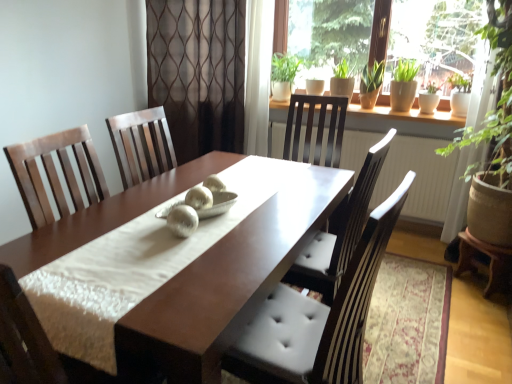
The width and height of the screenshot is (512, 384). What do you see at coordinates (318, 318) in the screenshot? I see `matte brown chair at center` at bounding box center [318, 318].

Where is `white glossy radiator at upper center`? white glossy radiator at upper center is located at coordinates (418, 177).

The height and width of the screenshot is (384, 512). What do you see at coordinates (498, 99) in the screenshot?
I see `green leafy plant at right` at bounding box center [498, 99].

What are the coordinates of `matte white table at lower right, the 2th table from the left` in the screenshot? It's located at (x=489, y=263).

What is the approximate width of brown sheer curtain at center?

brown sheer curtain at center is 23.97 centimeters wide.

Where is `matte brown chair at center`? The width and height of the screenshot is (512, 384). matte brown chair at center is located at coordinates (318, 318).

From a real-world perspective, is white glossy radiator at upper center under brown sheer curtain at center?

Yes.

Is white glossy radiator at upper center further to the viewer compared to brown sheer curtain at center?

No, white glossy radiator at upper center is closer to the viewer.

Is white glossy radiator at upper center shorter than brown sheer curtain at center?

Indeed, white glossy radiator at upper center has a lesser height compared to brown sheer curtain at center.

Which is behind, point (416, 148) or point (200, 69)?

The point (200, 69) is more distant.

Measure the distance from matte white table at lower right, which is the 1th table in right-to-left order, to shiny brown table at center, acting as the second table starting from the right.

The distance of matte white table at lower right, which is the 1th table in right-to-left order, from shiny brown table at center, acting as the second table starting from the right, is 4.75 feet.

From a real-world perspective, which is physically above, matte white table at lower right, the 2th table from the left, or shiny brown table at center, acting as the second table starting from the right?

In real-world perspective, shiny brown table at center, acting as the second table starting from the right, is above.

Can you tell me how much matte white table at lower right, which is the 1th table in right-to-left order, and shiny brown table at center, positioned as the 1th table in left-to-right order, differ in facing direction?

39.7 degrees separate the facing orientations of matte white table at lower right, which is the 1th table in right-to-left order, and shiny brown table at center, positioned as the 1th table in left-to-right order.

Image resolution: width=512 pixels, height=384 pixels. I want to click on table in front of the matte white table at lower right, which is the 1th table in right-to-left order, so click(230, 280).

Is green leafy plant at right not near matte brown chair at center?

green leafy plant at right is positioned a significant distance from matte brown chair at center.

Consider the image. From a real-world perspective, is green leafy plant at right positioned above or below matte brown chair at center?

From a real-world perspective, green leafy plant at right is physically above matte brown chair at center.

Looking at this image, can you tell me how much green leafy plant at right and matte brown chair at center differ in facing direction?

They differ by 63 degrees in their facing directions.

Which of these two, green leafy plant at right or matte brown chair at center, is smaller?

With smaller size is green leafy plant at right.

Is brown sheer curtain at center a part of matte brown chair at center?

Actually, brown sheer curtain at center is outside matte brown chair at center.

Where is `screen door above the matte brown chair at center (from the image's perspective)`? The width and height of the screenshot is (512, 384). screen door above the matte brown chair at center (from the image's perspective) is located at coordinates (198, 72).

Which object is positioned more to the right, matte brown chair at center or brown sheer curtain at center?

From the viewer's perspective, matte brown chair at center appears more on the right side.

Is matte brown chair at center not close to brown sheer curtain at center?

Indeed, matte brown chair at center is not near brown sheer curtain at center.

From the image's perspective, which one is positioned higher, green leafy plant at right or brown sheer curtain at center?

brown sheer curtain at center appears higher in the image.

Is green leafy plant at right next to brown sheer curtain at center?

No, green leafy plant at right is not touching brown sheer curtain at center.

Considering the sizes of objects green leafy plant at right and brown sheer curtain at center in the image provided, who is taller, green leafy plant at right or brown sheer curtain at center?

With more height is green leafy plant at right.

How distant is green leafy plant at right from brown sheer curtain at center?

A distance of 1.85 meters exists between green leafy plant at right and brown sheer curtain at center.

Where is `the 1st table in front of the green leafy plant at right, counting from the anchor's position`? This screenshot has width=512, height=384. the 1st table in front of the green leafy plant at right, counting from the anchor's position is located at coordinates (489, 263).

Is matte white table at lower right, which is the 1th table in right-to-left order, located outside green leafy plant at right?

Yes, matte white table at lower right, which is the 1th table in right-to-left order, is located beyond the bounds of green leafy plant at right.

How distant is matte white table at lower right, which is the 1th table in right-to-left order, from green leafy plant at right?

matte white table at lower right, which is the 1th table in right-to-left order, and green leafy plant at right are 25.08 inches apart from each other.

Is matte white table at lower right, the 2th table from the left, directly adjacent to green leafy plant at right?

No.

From the image's perspective, between brown sheer curtain at center and green leafy plant at right, which one is located above?

From the image's view, brown sheer curtain at center is above.

Does brown sheer curtain at center have a greater width compared to green leafy plant at right?

Correct, the width of brown sheer curtain at center exceeds that of green leafy plant at right.

Is point (241, 90) more distant than point (453, 260)?

Yes, it is.

Who is taller, brown sheer curtain at center or green leafy plant at right?

With more height is green leafy plant at right.

Locate an element on the screen. radiator below the brown sheer curtain at center (from a real-world perspective) is located at coordinates (418, 177).

You are a GUI agent. You are given a task and a screenshot of the screen. Output one action in this format:
    pyautogui.click(x=<x>, y=<y>)
    Task: Click on the table above the matte white table at lower right, which is the 1th table in right-to-left order (from the image's perspective)
    
    Given the screenshot: What is the action you would take?
    point(230,280)

Consider the image. Looking at the image, which one is located further to matte brown chair at center, matte white table at lower right, which is the 1th table in right-to-left order, or green leafy plant at right?

The object further to matte brown chair at center is green leafy plant at right.

Considering their positions, is brown sheer curtain at center positioned further to shiny brown table at center, acting as the second table starting from the right, than green leafy plant at right?

Result: brown sheer curtain at center is further to shiny brown table at center, acting as the second table starting from the right.

Considering their positions, is matte white table at lower right, which is the 1th table in right-to-left order, positioned further to shiny brown table at center, acting as the second table starting from the right, than brown sheer curtain at center?

matte white table at lower right, which is the 1th table in right-to-left order, is further to shiny brown table at center, acting as the second table starting from the right.

Looking at the image, which one is located closer to white glossy radiator at upper center, matte white table at lower right, the 2th table from the left, or brown sheer curtain at center?

Based on the image, matte white table at lower right, the 2th table from the left, appears to be nearer to white glossy radiator at upper center.

Based on their spatial positions, is matte white table at lower right, the 2th table from the left, or green leafy plant at right closer to brown sheer curtain at center?

green leafy plant at right lies closer to brown sheer curtain at center than the other object.

From the image, which object appears to be farther from matte brown chair at center, brown sheer curtain at center or white glossy radiator at upper center?

brown sheer curtain at center lies further to matte brown chair at center than the other object.

Considering their positions, is brown sheer curtain at center positioned closer to matte brown chair at center than shiny brown table at center, positioned as the 1th table in left-to-right order?

shiny brown table at center, positioned as the 1th table in left-to-right order.

Looking at the image, which one is located further to matte white table at lower right, the 2th table from the left, green leafy plant at right or matte brown chair at center?

matte brown chair at center is positioned further to the anchor matte white table at lower right, the 2th table from the left.

Where is `table between shiny brown table at center, acting as the second table starting from the right, and green leafy plant at right, in the horizontal direction`? This screenshot has height=384, width=512. table between shiny brown table at center, acting as the second table starting from the right, and green leafy plant at right, in the horizontal direction is located at coordinates (489, 263).

This screenshot has width=512, height=384. Find the location of `radiator positioned between matte brown chair at center and brown sheer curtain at center from near to far`. radiator positioned between matte brown chair at center and brown sheer curtain at center from near to far is located at coordinates (418, 177).

The width and height of the screenshot is (512, 384). Find the location of `chair between shiny brown table at center, positioned as the 1th table in left-to-right order, and matte white table at lower right, which is the 1th table in right-to-left order`. chair between shiny brown table at center, positioned as the 1th table in left-to-right order, and matte white table at lower right, which is the 1th table in right-to-left order is located at coordinates (318, 318).

What are the coordinates of `radiator that lies between green leafy plant at right and matte white table at lower right, the 2th table from the left, from top to bottom` in the screenshot? It's located at (418, 177).